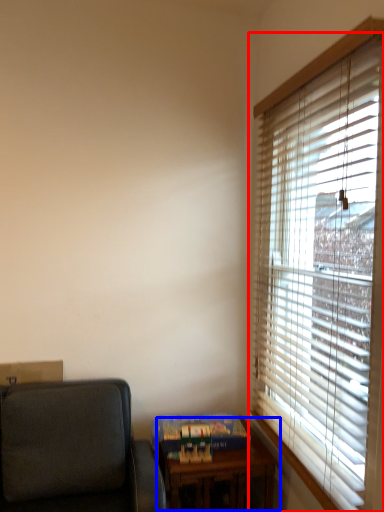
Question: Which of the following is the closest to the observer, window blind (highlighted by a red box) or table (highlighted by a blue box)?

Choices:
 (A) window blind
 (B) table

Answer: (A)